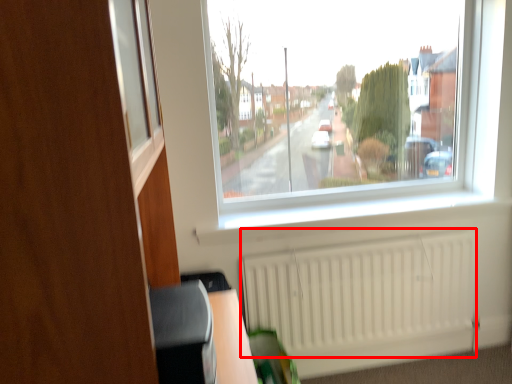
Question: From the image's perspective, what is the correct spatial relationship of radiator (annotated by the red box) in relation to dresser?

Choices:
 (A) above
 (B) below

Answer: (B)